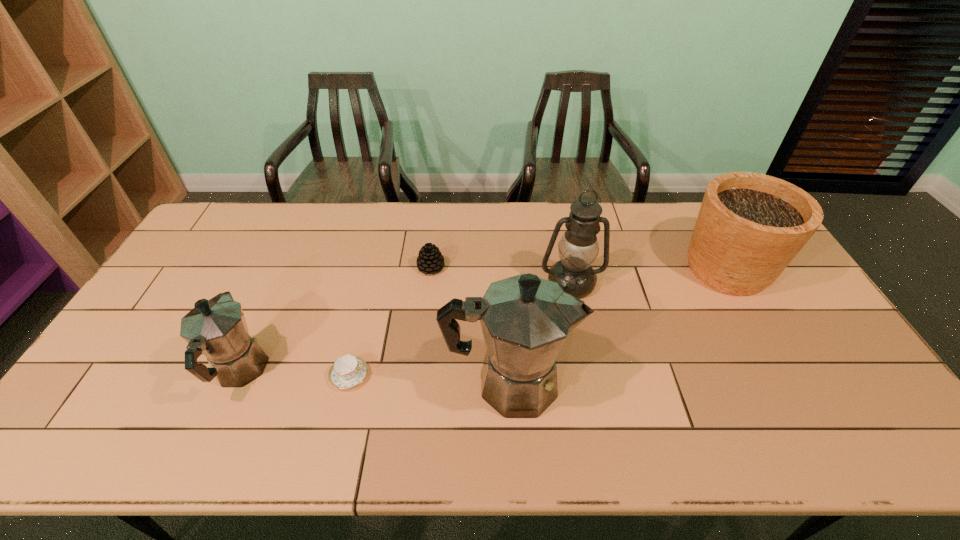
Please point a free position for a coffeepot on the right. Please provide its 2D coordinates. Your answer should be formatted as a tuple, i.e. [(x, y)], where the tuple contains the x and y coordinates of a point satisfying the conditions above.

[(791, 396)]